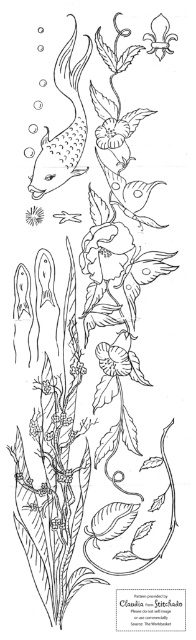
In the underwater scene, you see a matte black fish at upper left and a matte black flower at upper left. Which one appears closer to you based on their positions?

The matte black fish at upper left is in front of the matte black flower at upper left, so it appears closer.

Based on the black and white underwater scene, where exactly is the matte black fish at upper left located in terms of coordinates?

The matte black fish at upper left is located at coordinates point (65, 128).

You are an underwater explorer looking at the black and white drawing. You see the white paper flower at upper center. Can you estimate its position using coordinates from 0 to 1 in both x and y axes? Please provide the coordinates as a point in parentheses.

The white paper flower at upper center is located at point (158, 36).